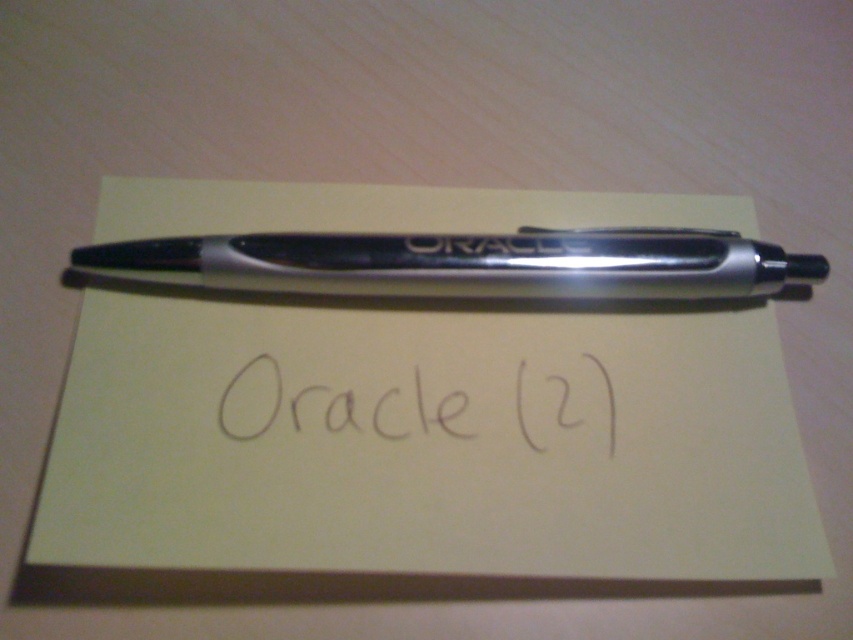
Is yellow paper at center above metallic silver pen at center?

Incorrect, yellow paper at center is not positioned above metallic silver pen at center.

Between point (349, 323) and point (173, 278), which one is positioned behind?

Point (349, 323)

Is point (28, 548) positioned in front of point (393, 282)?

Yes, it is in front of point (393, 282).

Locate an element on the screen. This screenshot has width=853, height=640. yellow paper at center is located at coordinates (422, 445).

Does yellow paper at center have a larger size compared to black ink writing at center?

Correct, yellow paper at center is larger in size than black ink writing at center.

Who is higher up, yellow paper at center or black ink writing at center?

yellow paper at center is higher up.

What are the coordinates of `yellow paper at center` in the screenshot? It's located at (422, 445).

Is metallic silver pen at center bigger than black ink writing at center?

Yes, metallic silver pen at center is bigger than black ink writing at center.

Is metallic silver pen at center below black ink writing at center?

Actually, metallic silver pen at center is above black ink writing at center.

Between point (277, 257) and point (503, 420), which one is positioned behind?

The point (277, 257) is more distant.

What are the coordinates of `metallic silver pen at center` in the screenshot? It's located at (466, 264).